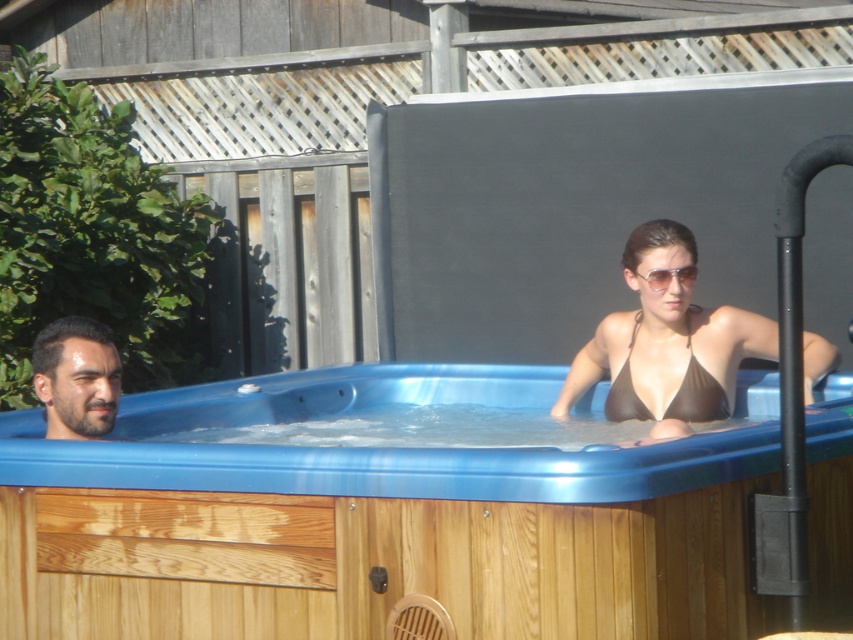
Who is taller, brown matte bikini at upper right or sunglasses at upper center?

With more height is brown matte bikini at upper right.

Is brown matte bikini at upper right further to the viewer compared to sunglasses at upper center?

That is False.

Between point (654, 397) and point (674, 268), which one is positioned behind?

The point (654, 397) is more distant.

At what (x,y) coordinates should I click in order to perform the action: click on brown matte bikini at upper right. Please return your answer as a coordinate pair (x, y). The image size is (853, 640). Looking at the image, I should click on (666, 344).

Is blue plastic hot tub at center to the right of brown matte bikini at upper right from the viewer's perspective?

Incorrect, blue plastic hot tub at center is not on the right side of brown matte bikini at upper right.

Is point (688, 524) in front of point (648, 266)?

Yes, point (688, 524) is in front of point (648, 266).

Image resolution: width=853 pixels, height=640 pixels. Identify the location of blue plastic hot tub at center. (384, 536).

Between dark brown hair at left and sunglasses at upper center, which one is positioned higher?

sunglasses at upper center is above.

Can you confirm if dark brown hair at left is wider than sunglasses at upper center?

Yes, dark brown hair at left is wider than sunglasses at upper center.

Does point (115, 349) come farther from viewer compared to point (654, 282)?

No, it is in front of (654, 282).

You are a GUI agent. You are given a task and a screenshot of the screen. Output one action in this format:
    pyautogui.click(x=<x>, y=<y>)
    Task: Click on the dark brown hair at left
    
    Given the screenshot: What is the action you would take?
    pyautogui.click(x=76, y=378)